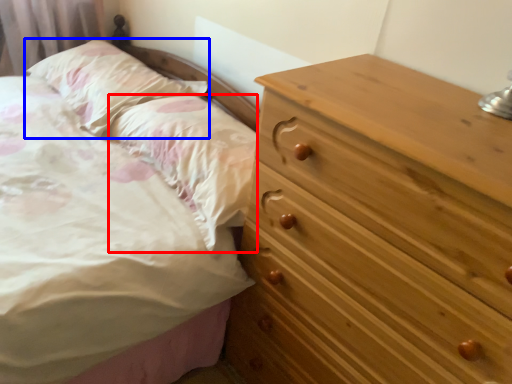
Question: Which object appears closest to the camera in this image, pillow (highlighted by a red box) or pillow (highlighted by a blue box)?

Choices:
 (A) pillow
 (B) pillow

Answer: (A)